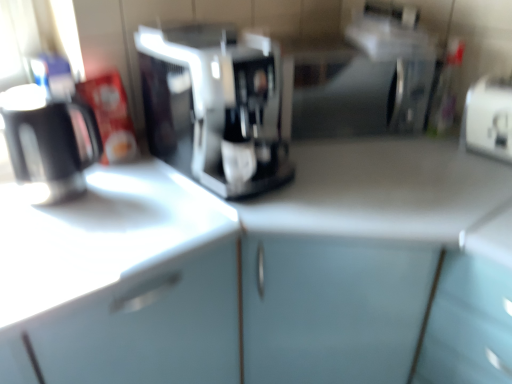
Question: Can you confirm if matte black mug at left is bigger than white plastic toaster at right?

Choices:
 (A) yes
 (B) no

Answer: (A)

Question: Is the surface of matte black mug at left in direct contact with white plastic toaster at right?

Choices:
 (A) yes
 (B) no

Answer: (B)

Question: Is matte black mug at left further to the viewer compared to white plastic toaster at right?

Choices:
 (A) no
 (B) yes

Answer: (A)

Question: Does matte black mug at left have a smaller size compared to white plastic toaster at right?

Choices:
 (A) no
 (B) yes

Answer: (A)

Question: Is matte black mug at left at the left side of white plastic toaster at right?

Choices:
 (A) yes
 (B) no

Answer: (A)

Question: Does matte black mug at left have a lesser height compared to white plastic toaster at right?

Choices:
 (A) yes
 (B) no

Answer: (B)

Question: Is the position of sleek silver coffee maker at center less distant than that of white plastic toaster at right?

Choices:
 (A) no
 (B) yes

Answer: (B)

Question: From a real-world perspective, is sleek silver coffee maker at center located beneath white plastic toaster at right?

Choices:
 (A) no
 (B) yes

Answer: (A)

Question: Is sleek silver coffee maker at center positioned beyond the bounds of white plastic toaster at right?

Choices:
 (A) yes
 (B) no

Answer: (A)

Question: Does sleek silver coffee maker at center lie behind white plastic toaster at right?

Choices:
 (A) no
 (B) yes

Answer: (A)

Question: Considering the relative sizes of sleek silver coffee maker at center and white plastic toaster at right in the image provided, is sleek silver coffee maker at center thinner than white plastic toaster at right?

Choices:
 (A) yes
 (B) no

Answer: (B)

Question: From the image's perspective, is sleek silver coffee maker at center under white plastic toaster at right?

Choices:
 (A) no
 (B) yes

Answer: (A)

Question: Can you confirm if white plastic toaster at right is wider than white glossy counter top at left?

Choices:
 (A) no
 (B) yes

Answer: (A)